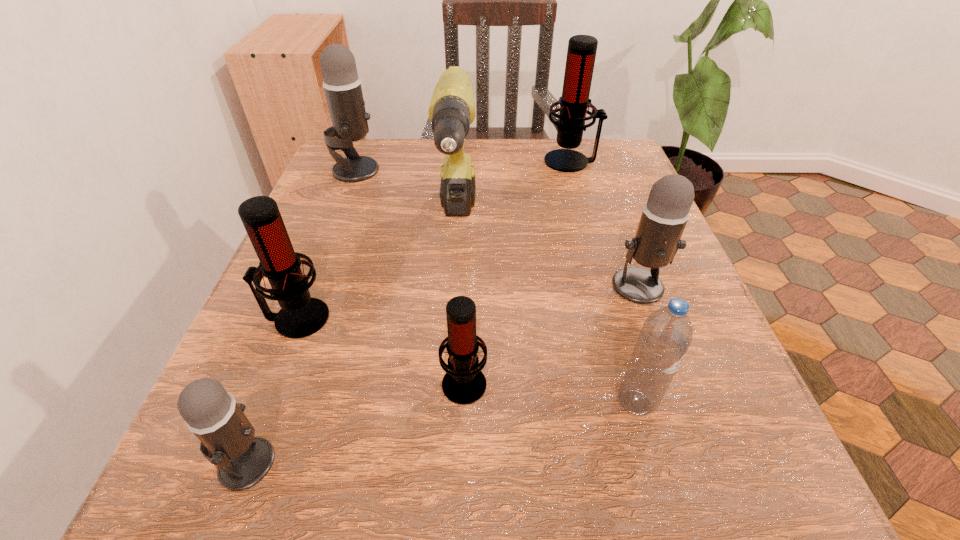
In the image, there is a desktop. In order to click on blank space at the far left corner in this screenshot , I will do `click(399, 143)`.

The image size is (960, 540). I want to click on vacant area at the far right corner of the desktop, so click(x=620, y=145).

You are a GUI agent. You are given a task and a screenshot of the screen. Output one action in this format:
    pyautogui.click(x=<x>, y=<y>)
    Task: Click on the free location at the near right corner of the desktop
    
    Given the screenshot: What is the action you would take?
    pyautogui.click(x=660, y=485)

Find the location of a particular element. The height and width of the screenshot is (540, 960). free space between the second nearest gray microphone and the drill is located at coordinates [548, 255].

The image size is (960, 540). I want to click on vacant space in between the biggest gray microphone and the second biggest red microphone, so click(326, 244).

You are a GUI agent. You are given a task and a screenshot of the screen. Output one action in this format:
    pyautogui.click(x=<x>, y=<y>)
    Task: Click on the vacant area that lies between the smallest red microphone and the blue water bottle
    
    Given the screenshot: What is the action you would take?
    pyautogui.click(x=550, y=392)

What are the coordinates of `vacant region between the smallest gray microphone and the blue water bottle` in the screenshot? It's located at pyautogui.click(x=442, y=432).

Find the location of a particular element. Image resolution: width=960 pixels, height=540 pixels. vacant space that is in between the blue water bottle and the rightmost red microphone is located at coordinates (603, 281).

You are a GUI agent. You are given a task and a screenshot of the screen. Output one action in this format:
    pyautogui.click(x=<x>, y=<y>)
    Task: Click on the vacant point located between the second biggest gray microphone and the drill
    This screenshot has height=540, width=960.
    Given the screenshot: What is the action you would take?
    pyautogui.click(x=548, y=255)

Locate an element on the screen. The height and width of the screenshot is (540, 960). vacant space that is in between the drill and the biggest gray microphone is located at coordinates (406, 197).